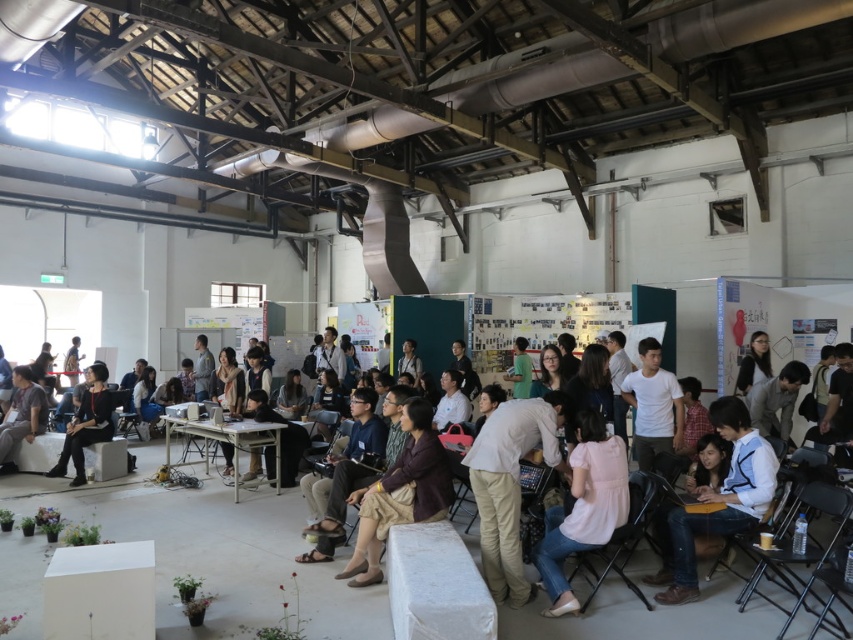
You are standing at the entrance of the warehouse and see both the matte black jacket at center and the gray fabric shirt at lower left. Which person is closer to you?

The matte black jacket at center is closer to the viewer than the gray fabric shirt at lower left.

You are organizing a clothing donation drive and need to categorize items by size. You have a light beige pants at center and a gray fabric shirt at lower left. Which item would you place in the small size bin?

The light beige pants at center has a smaller size compared to gray fabric shirt at lower left, so it should be placed in the small size bin.